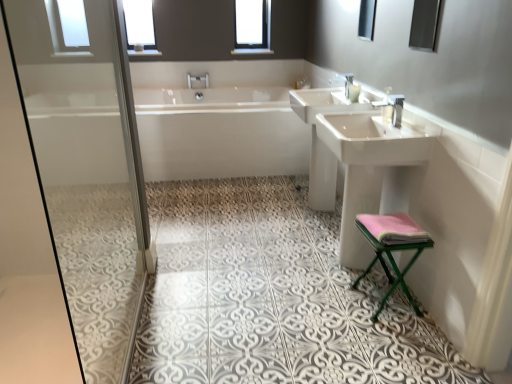
Question: In the image, is white glossy sink at right, acting as the first sink starting from the front, on the left side or the right side of clear glass window at upper center, marked as the 2th window in a left-to-right arrangement?

Choices:
 (A) right
 (B) left

Answer: (A)

Question: Is white glossy sink at right, arranged as the second sink when viewed from the back, bigger or smaller than clear glass window at upper center, marked as the 2th window in a left-to-right arrangement?

Choices:
 (A) big
 (B) small

Answer: (A)

Question: Estimate the real-world distances between objects in this image. Which object is farther from the silver metallic tap at upper center, positioned as the 2th tap in top-to-bottom order?

Choices:
 (A) pink fabric stool at lower right
 (B) white glossy sink at center, arranged as the first sink when viewed from the back
 (C) white textured tile at center
 (D) white glossy bathtub at center
 (E) white glass window at upper left, positioned as the 2th window in right-to-left order

Answer: (E)

Question: Based on their relative distances, which object is farther from the glossy glass mirror at upper center, marked as the second mirror in a bottom-to-top arrangement?

Choices:
 (A) white glossy bathtub at center
 (B) white textured tile at center
 (C) clear glass window at upper center, the 1th window from the right
 (D) silver metallic tap at upper center, marked as the 2th tap in a front-to-back arrangement
 (E) matte glass mirror at upper right, which is the 2th mirror from top to bottom

Answer: (D)